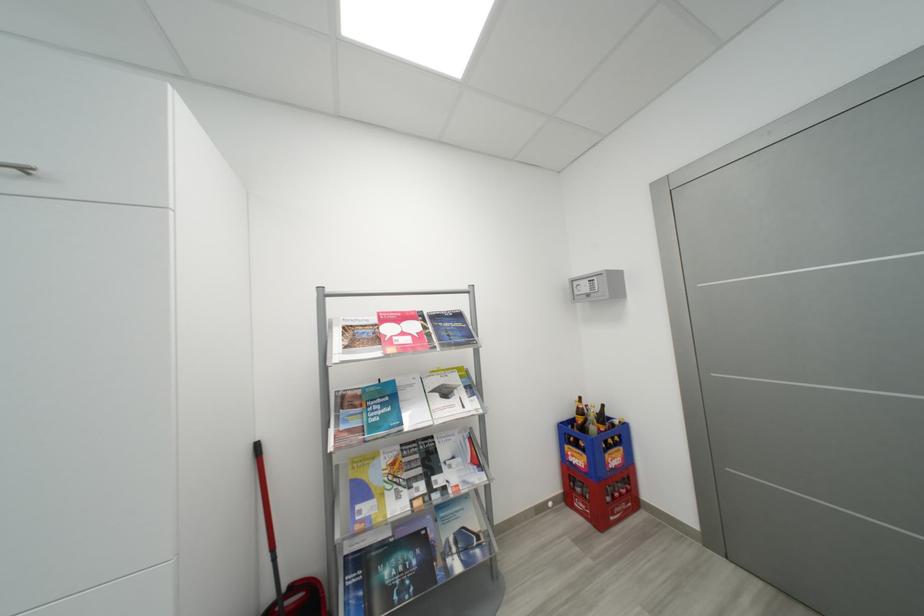
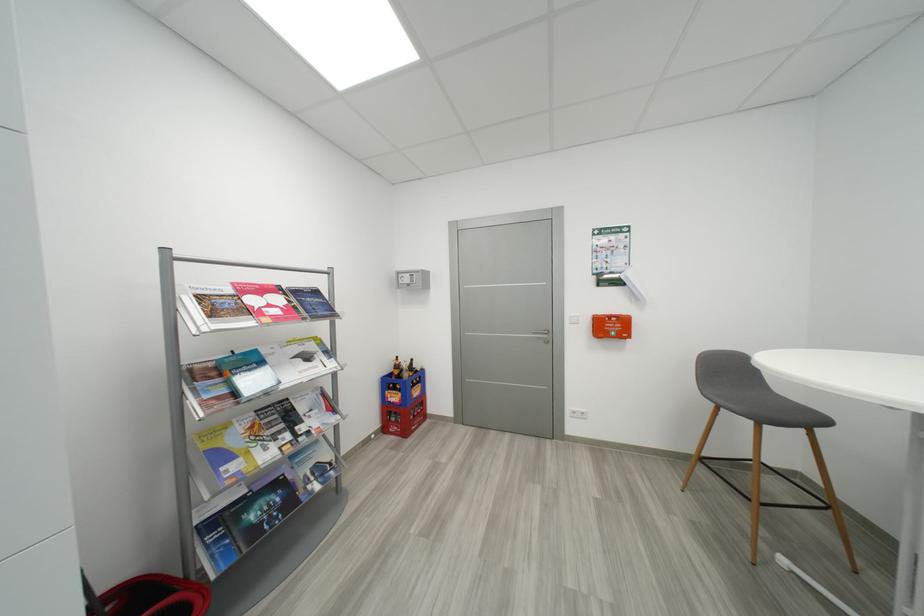
Locate, in the second image, the point that corresponds to the point at 590,290 in the first image.

(412, 282)